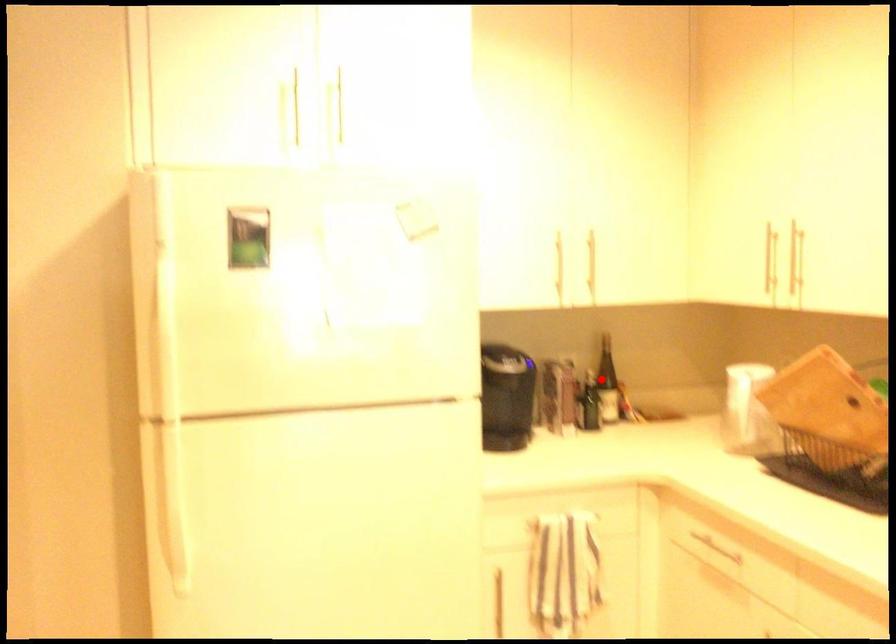
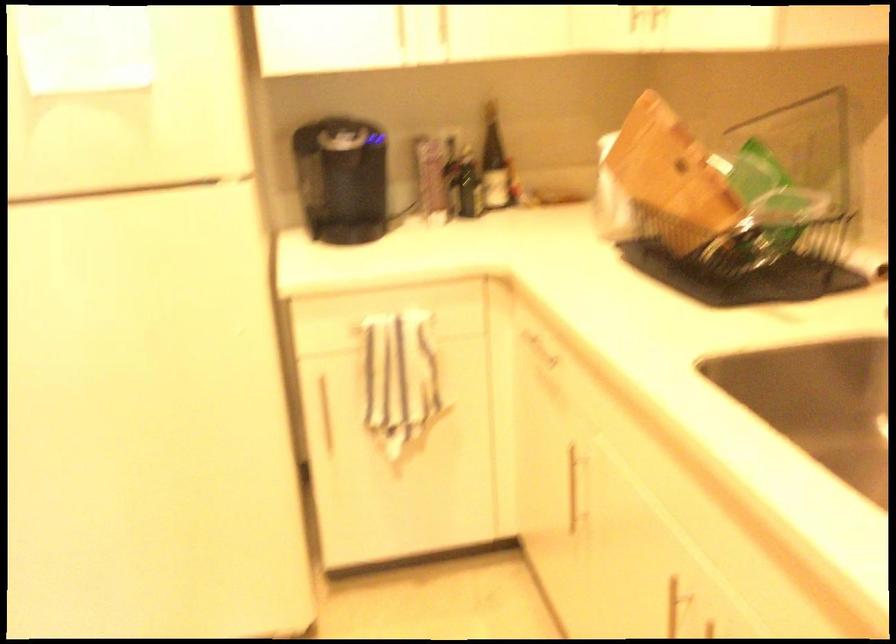
Locate, in the second image, the point that corresponds to the highlighted location in the first image.

(494, 163)